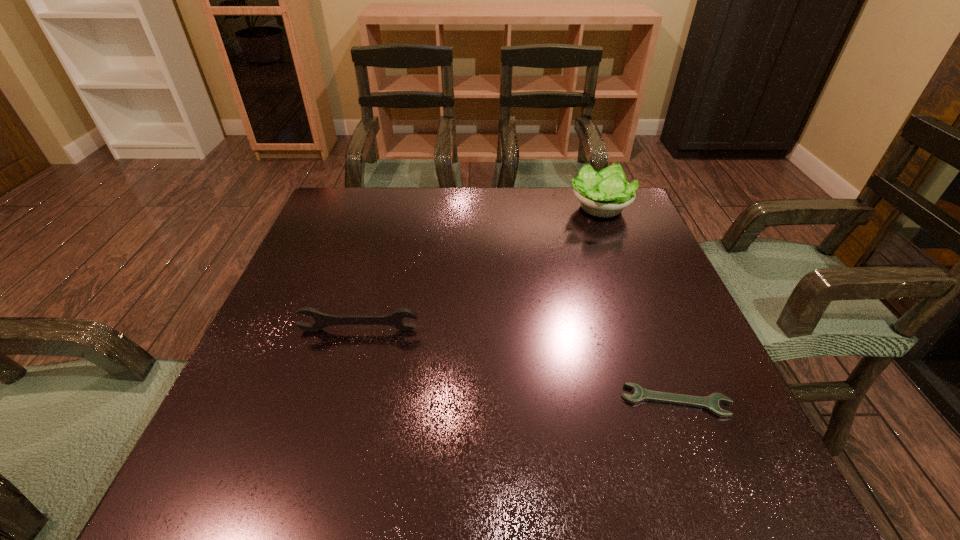
At what (x,y) coordinates should I click in order to perform the action: click on free spot between the second shortest object and the shortest object. Please return your answer as a coordinate pair (x, y). The width and height of the screenshot is (960, 540). Looking at the image, I should click on (517, 366).

Where is `free space between the left wrench and the tallest object`? The image size is (960, 540). free space between the left wrench and the tallest object is located at coordinates (479, 269).

This screenshot has height=540, width=960. Find the location of `free space between the lettuce and the left wrench`. free space between the lettuce and the left wrench is located at coordinates (479, 269).

Image resolution: width=960 pixels, height=540 pixels. I want to click on vacant region between the tallest object and the second farthest object, so click(479, 269).

What are the coordinates of `vacant space that's between the taller wrench and the tallest object` in the screenshot? It's located at (479, 269).

Image resolution: width=960 pixels, height=540 pixels. I want to click on free spot between the second shortest object and the shorter wrench, so click(x=517, y=366).

Find the location of `blank region between the farther wrench and the nearer wrench`. blank region between the farther wrench and the nearer wrench is located at coordinates [x=517, y=366].

Where is `free space between the nearer wrench and the lettuce`? free space between the nearer wrench and the lettuce is located at coordinates (637, 305).

You are a GUI agent. You are given a task and a screenshot of the screen. Output one action in this format:
    pyautogui.click(x=<x>, y=<y>)
    Task: Click on the object that ranks as the second closest to the farther wrench
    The height and width of the screenshot is (540, 960).
    Given the screenshot: What is the action you would take?
    pyautogui.click(x=606, y=193)

Locate which object ranks second in proximity to the lettuce. Please provide its 2D coordinates. Your answer should be formatted as a tuple, i.e. [(x, y)], where the tuple contains the x and y coordinates of a point satisfying the conditions above.

[(322, 320)]